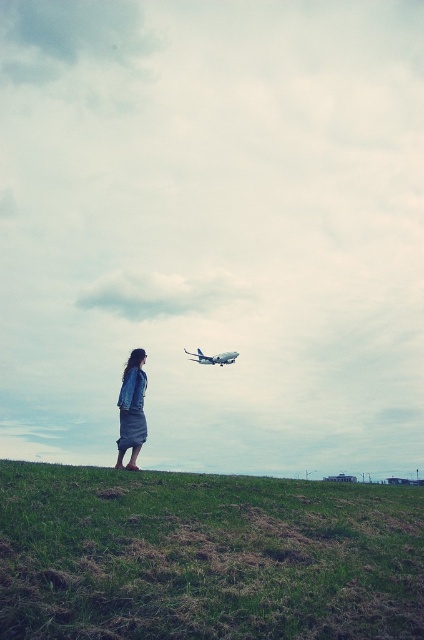
You are standing on the grassy hill and want to walk towards the denim jacket at lower left. Which direction should you move relative to the green grassy hill at lower center?

You should move to the left relative to the green grassy hill at lower center because the denim jacket at lower left is located to the left of the hill.

You are a bird flying at a certain height. You want to land on the green grassy hill at lower center but first need to pass under the white matte airplane at center. Is this possible?

The green grassy hill at lower center is much taller than the white matte airplane at center, so the bird would not be able to pass under the airplane because the hill is higher.

You are standing at the point with coordinates point (147, 381) and want to move towards the point with coordinates point (357, 520). Which direction should you move to get closer to that point?

To move towards point (357, 520) from point (147, 381), you should move upwards and to the right since point (357, 520) is closer to the camera than point (147, 381).